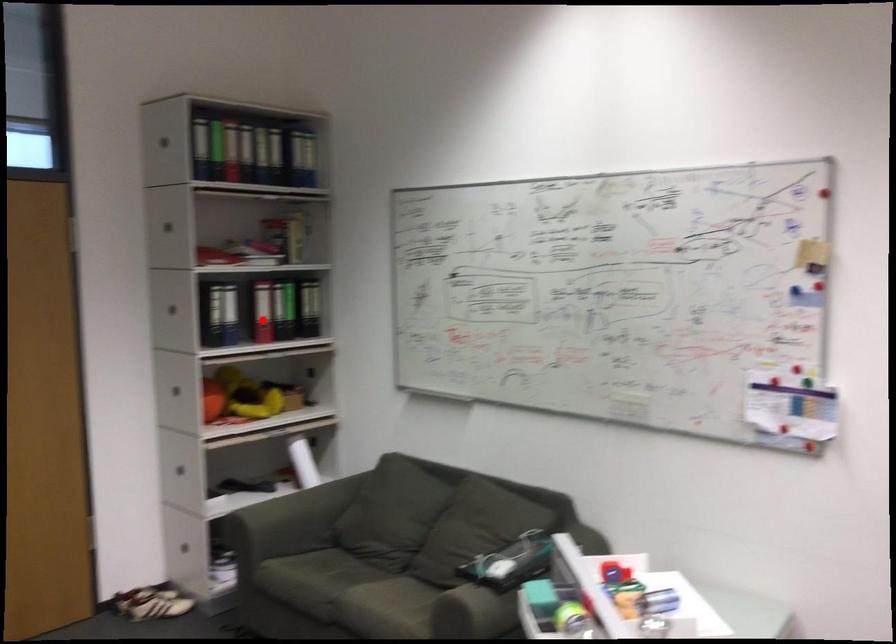
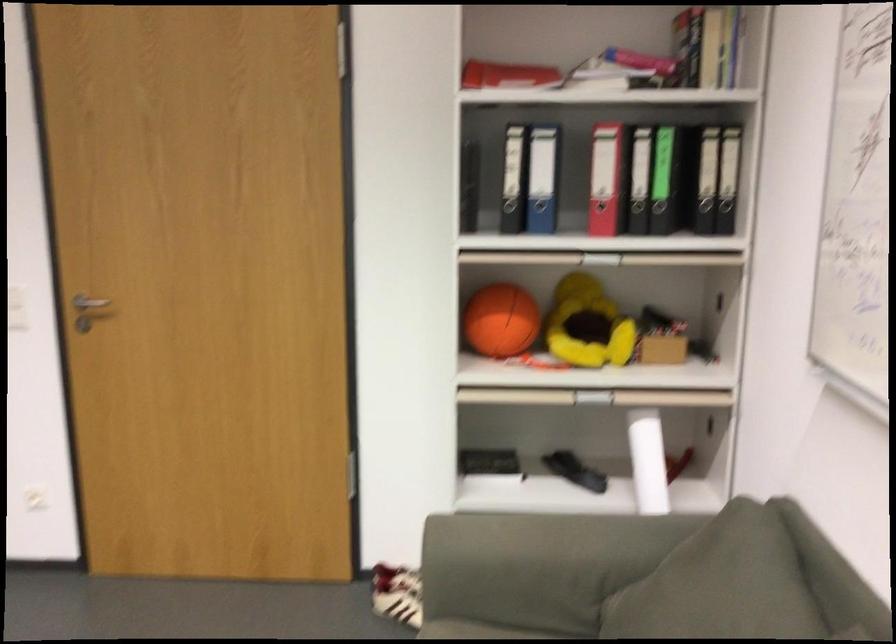
Where in the second image is the point corresponding to the highlighted location from the first image?

(606, 178)